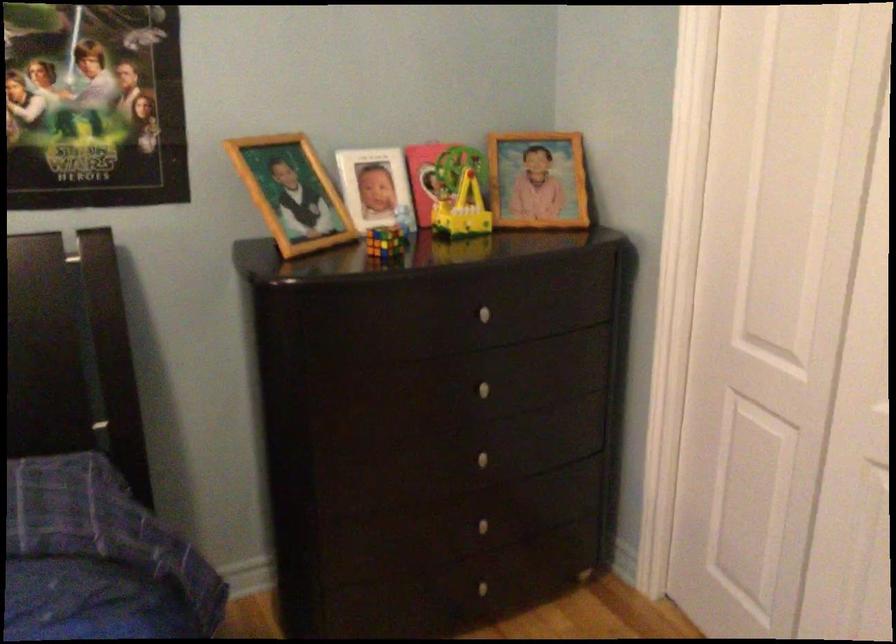
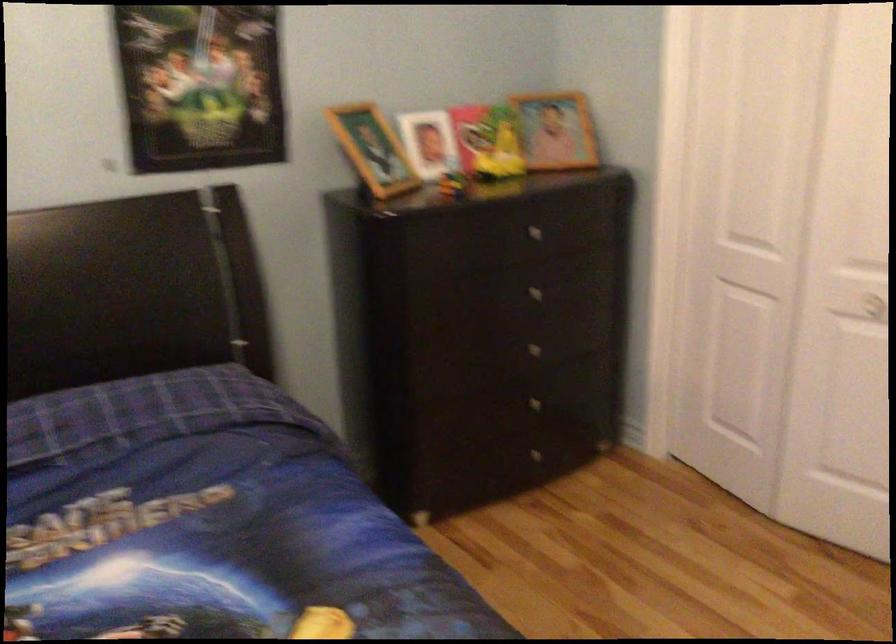
Where in the second image is the point corresponding to pixel 450 192 from the first image?

(487, 142)